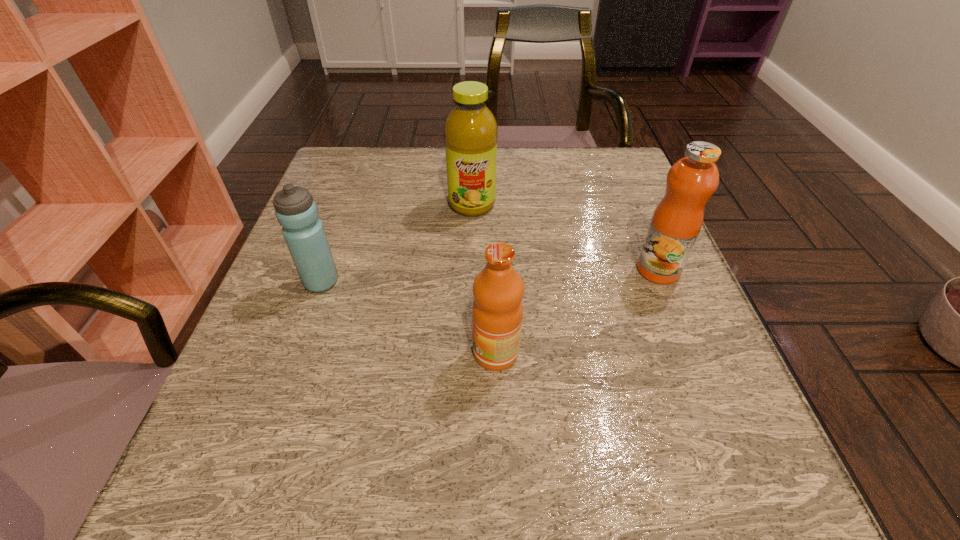
At what (x,y) coordinates should I click in order to perform the action: click on vacant space located 0.150m on the label side of the nearest fruit juice. Please return your answer as a coordinate pair (x, y). This screenshot has height=540, width=960. Looking at the image, I should click on (382, 353).

Locate an element on the screen. blank space located on the left of the leftmost object is located at coordinates (273, 282).

Image resolution: width=960 pixels, height=540 pixels. I want to click on object that is at the far edge, so click(x=470, y=131).

Image resolution: width=960 pixels, height=540 pixels. Identify the location of object located in the left edge section of the desktop. [297, 213].

Identify the location of object positioned at the right edge. (677, 220).

This screenshot has height=540, width=960. Find the location of `blank area at the near edge`. blank area at the near edge is located at coordinates (517, 476).

Find the location of a particular element. This screenshot has width=960, height=540. free space at the left edge of the desktop is located at coordinates (319, 199).

The width and height of the screenshot is (960, 540). What are the coordinates of `vacant space at the right edge of the desktop` in the screenshot? It's located at (607, 205).

Identify the location of vacant region at the far left corner of the desktop. (382, 157).

This screenshot has height=540, width=960. I want to click on vacant space at the near left corner, so click(x=183, y=502).